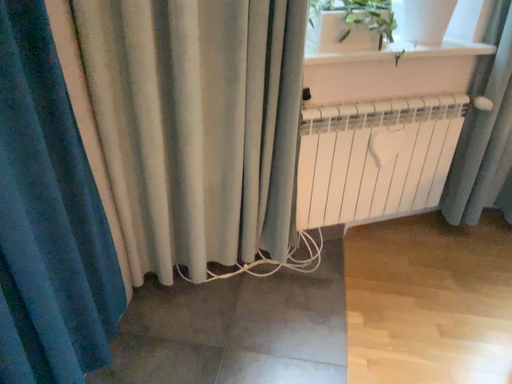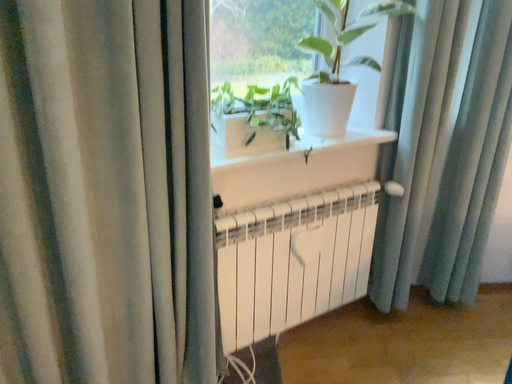
Question: Which way did the camera rotate in the video?

Choices:
 (A) rotated left
 (B) rotated right

Answer: (B)